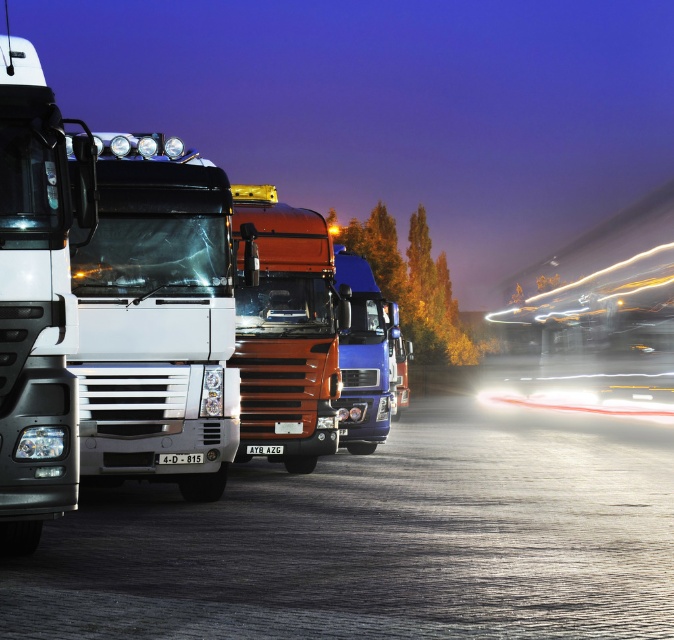
You are a pedestrian standing on the sidewalk and see the white glossy truck at center and the glossy blue truck at center. Which truck is closer to you?

The white glossy truck at center is closer to you because it is positioned in front of the glossy blue truck at center.

From the picture: You are a delivery driver who needs to park your truck in a specific spot. You see the white glossy trailer truck at left. Based on its position, can you determine if the parking spot is available?

The white glossy trailer truck at left is located at point (32, 300), which indicates it is parked in the designated spot, so the parking spot is not available.

You are a delivery driver who needs to park your 6.5 meter long truck between the glossy blue truck at center and the matte white headlight at left. Can your truck fit in the space between them without overlapping either?

The space between the glossy blue truck at center and the matte white headlight at left is 7.45 meters. Since your truck is 6.5 meters long, it can fit in the space as there is enough room without overlapping either object.